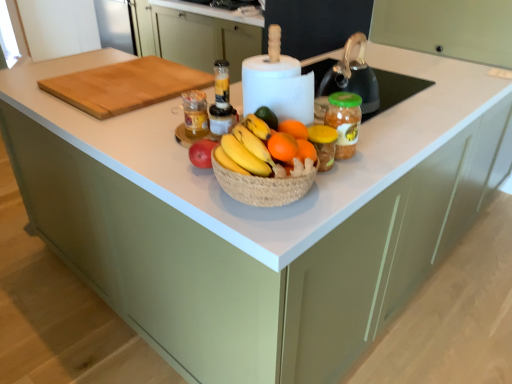
You are a GUI agent. You are given a task and a screenshot of the screen. Output one action in this format:
    pyautogui.click(x=<x>, y=<y>)
    Task: Click on the vacant area that lies to the right of green plastic jar at center
    
    Given the screenshot: What is the action you would take?
    pyautogui.click(x=378, y=154)